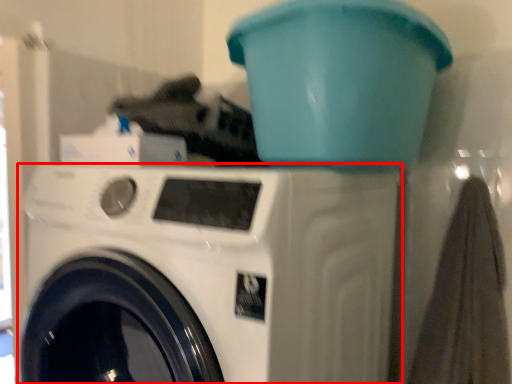
Question: Observing the image, what is the correct spatial positioning of washing machine (annotated by the red box) in reference to water cooler?

Choices:
 (A) left
 (B) right

Answer: (A)